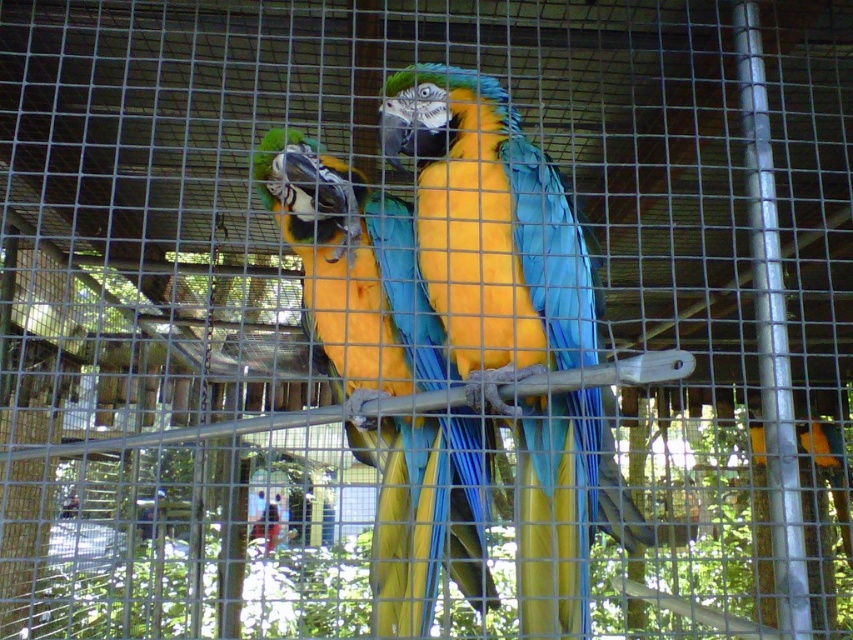
Consider the image. You are a zookeeper who needs to locate the blue glossy parrot at center in the enclosure. According to the coordinates provided, where should you look to find it?

The blue glossy parrot at center is located at coordinates point (x=512, y=317).

You are a bird trainer who needs to place a 6 inches wide feeding tray between the blue glossy parrot at center and the shiny blue parrot at center. Can the feeding tray fit in the space between them?

The distance between the blue glossy parrot at center and the shiny blue parrot at center is 5.70 inches, so the 6 inches wide feeding tray cannot fit in the space between them.

You are a zookeeper who needs to feed two parrots in the cage. The cage has a feeding tray at the bottom. Which parrot should you place the food closer to, the blue glossy parrot at center or the shiny blue parrot at center?

The blue glossy parrot at center is positioned over the shiny blue parrot at center, so you should place the food closer to the shiny blue parrot at center since it is lower down near the feeding tray.